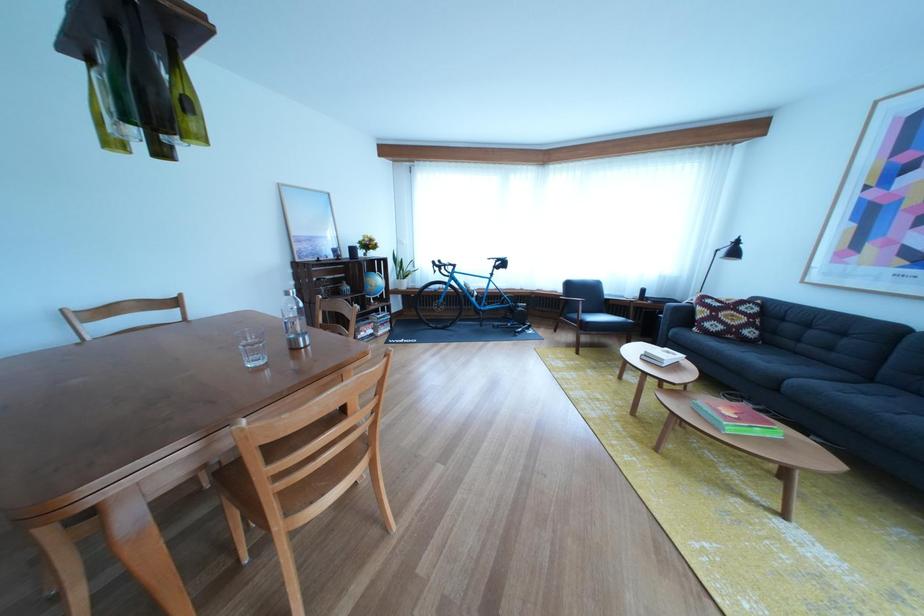
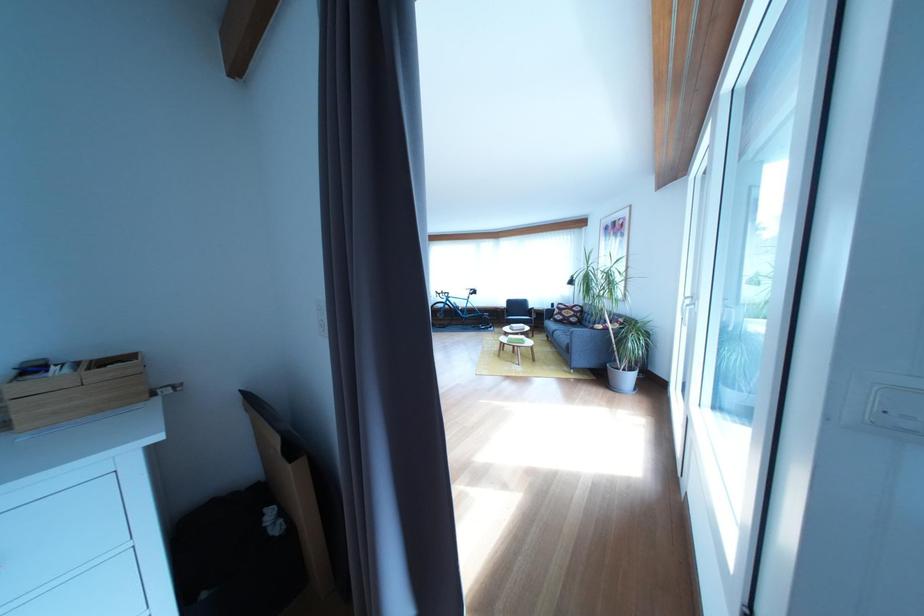
In the second image, find the point that corresponds to (734,333) in the first image.

(575, 323)